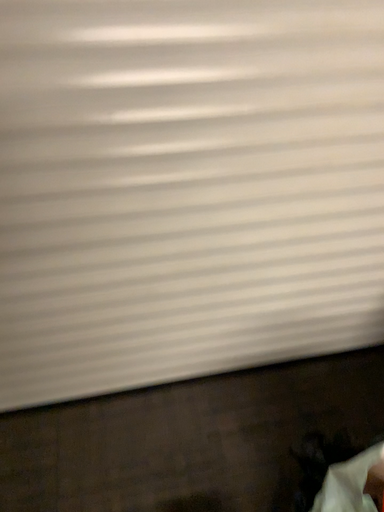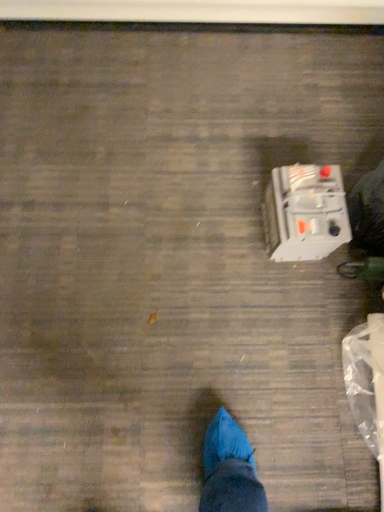
Question: How did the camera likely rotate when shooting the video?

Choices:
 (A) rotated downward
 (B) rotated upward

Answer: (A)